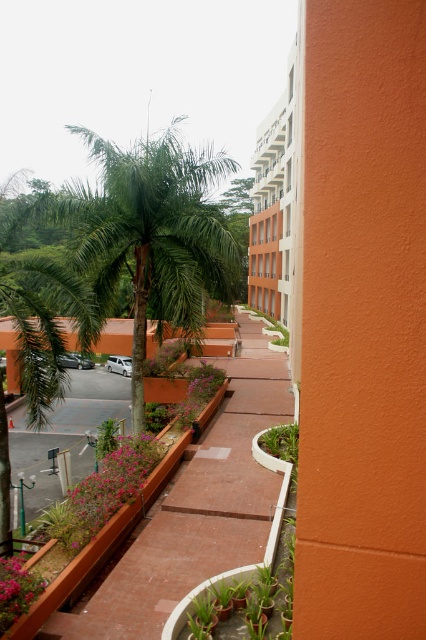
Question: Among these objects, which one is farthest from the camera?

Choices:
 (A) green leafy palm tree at center
 (B) white concrete building at upper center
 (C) brick pathway at center

Answer: (A)

Question: Which of these objects is positioned closest to the white concrete building at upper center?

Choices:
 (A) pink matte flowers at lower left
 (B) green leafy palm tree at center

Answer: (B)

Question: Is green leafy palm tree at center positioned before white concrete building at upper center?

Choices:
 (A) yes
 (B) no

Answer: (B)

Question: Which of the following is the closest to the observer?

Choices:
 (A) (273, 385)
 (B) (180, 300)
 (C) (11, 579)

Answer: (C)

Question: Does green leafy palm tree at center have a larger size compared to pink matte flowers at lower left?

Choices:
 (A) no
 (B) yes

Answer: (B)

Question: Can you confirm if white concrete building at upper center is positioned below pink matte flowers at lower left?

Choices:
 (A) yes
 (B) no

Answer: (B)